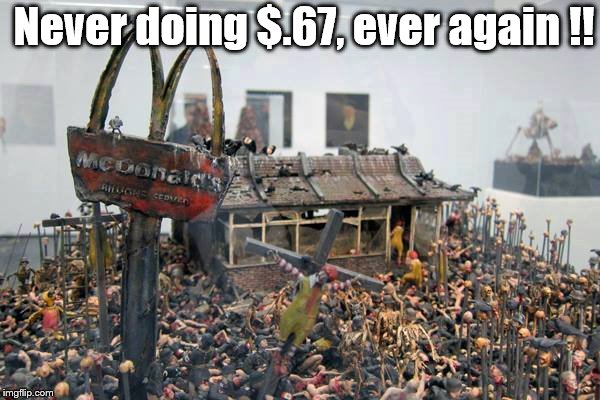
You are a GUI agent. You are given a task and a screenshot of the screen. Output one action in this format:
    pyautogui.click(x=<x>, y=<y>)
    Task: Click on the windows
    The width and height of the screenshot is (600, 400).
    Given the screenshot: What is the action you would take?
    pyautogui.click(x=220, y=231), pyautogui.click(x=241, y=254), pyautogui.click(x=276, y=233), pyautogui.click(x=307, y=235), pyautogui.click(x=348, y=248), pyautogui.click(x=372, y=240)